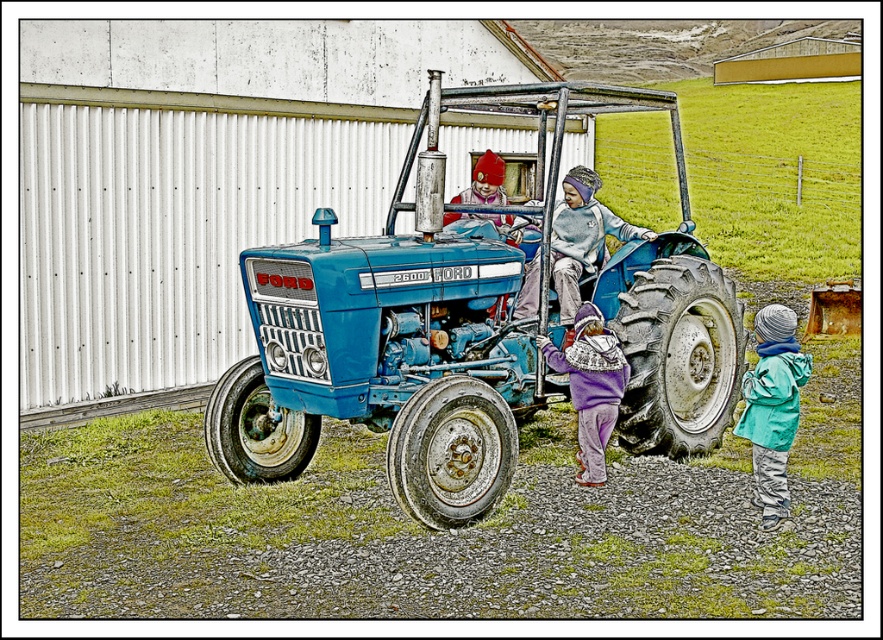
Question: Is blue metallic tractor at center bigger than purple fleece jacket at center?

Choices:
 (A) yes
 (B) no

Answer: (B)

Question: Does blue metallic tractor at center appear on the right side of purple fleece jacket at center?

Choices:
 (A) yes
 (B) no

Answer: (B)

Question: Among these points, which one is farthest from the camera?

Choices:
 (A) (600, 227)
 (B) (751, 392)
 (C) (695, 376)
 (D) (585, 444)

Answer: (A)

Question: Which of these objects is positioned closest to the blue metallic tractor at center?

Choices:
 (A) light blue fleece jacket at center
 (B) purple fleece jacket at center
 (C) teal fabric jacket at lower right

Answer: (B)

Question: Which point is farther to the camera?

Choices:
 (A) purple fleece jacket at center
 (B) light blue fleece jacket at center
 (C) blue metallic tractor at center
 (D) teal fabric jacket at lower right

Answer: (B)

Question: Is light blue fleece jacket at center closer to the viewer compared to purple fleece jacket at center?

Choices:
 (A) yes
 (B) no

Answer: (B)